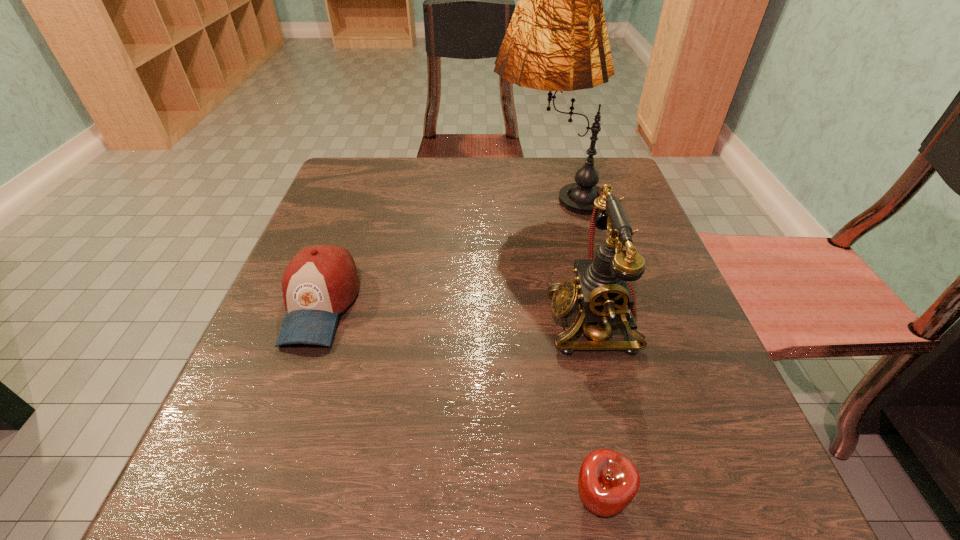
Find the location of a particular element. the tallest object is located at coordinates (557, 40).

You are a GUI agent. You are given a task and a screenshot of the screen. Output one action in this format:
    pyautogui.click(x=<x>, y=<y>)
    Task: Click on the lampshade
    
    Given the screenshot: What is the action you would take?
    pyautogui.click(x=557, y=40)

The height and width of the screenshot is (540, 960). What are the coordinates of `telephone` in the screenshot? It's located at (600, 290).

Where is `the leftmost object`? This screenshot has height=540, width=960. the leftmost object is located at coordinates (321, 281).

Identify the location of the nearest object. (608, 481).

At what (x,y) coordinates should I click in order to perform the action: click on free space located 0.130m on the front-facing side of the farthest object. Please return your answer as a coordinate pair (x, y). The image size is (960, 540). Looking at the image, I should click on (436, 195).

Where is `free space located 0.330m on the front-facing side of the farthest object`? The height and width of the screenshot is (540, 960). free space located 0.330m on the front-facing side of the farthest object is located at coordinates (351, 195).

Identify the location of free space located 0.140m on the front-facing side of the farthest object. (431, 195).

Identify the location of blank space located 0.280m on the front of the second tallest object, featuring the rotary dial. Image resolution: width=960 pixels, height=540 pixels. (385, 320).

You are a GUI agent. You are given a task and a screenshot of the screen. Output one action in this format:
    pyautogui.click(x=<x>, y=<y>)
    Task: Click on the vacant area located 0.300m on the front of the second tallest object, featuring the rotary dial
    
    Given the screenshot: What is the action you would take?
    pyautogui.click(x=373, y=320)